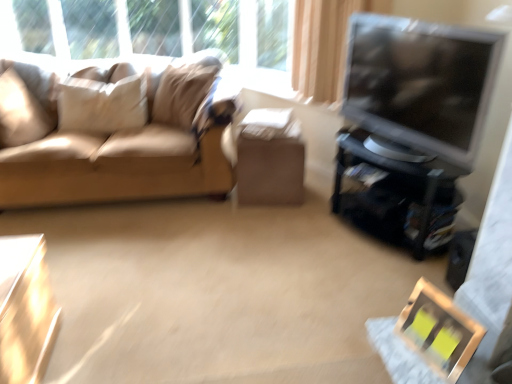
Where is `vacant area in front of matte black tv stand at right`? vacant area in front of matte black tv stand at right is located at coordinates (364, 280).